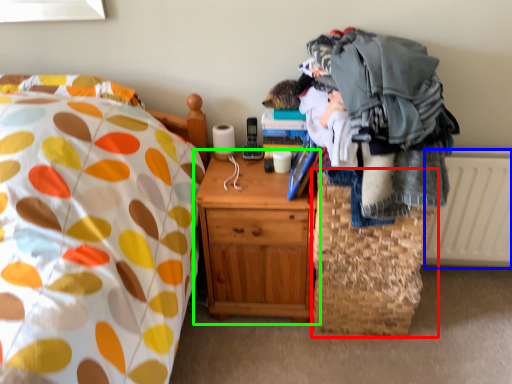
Question: Which object is positioned farthest from basket (highlighted by a red box)? Select from radiator (highlighted by a blue box) and nightstand (highlighted by a green box).

Choices:
 (A) radiator
 (B) nightstand

Answer: (A)